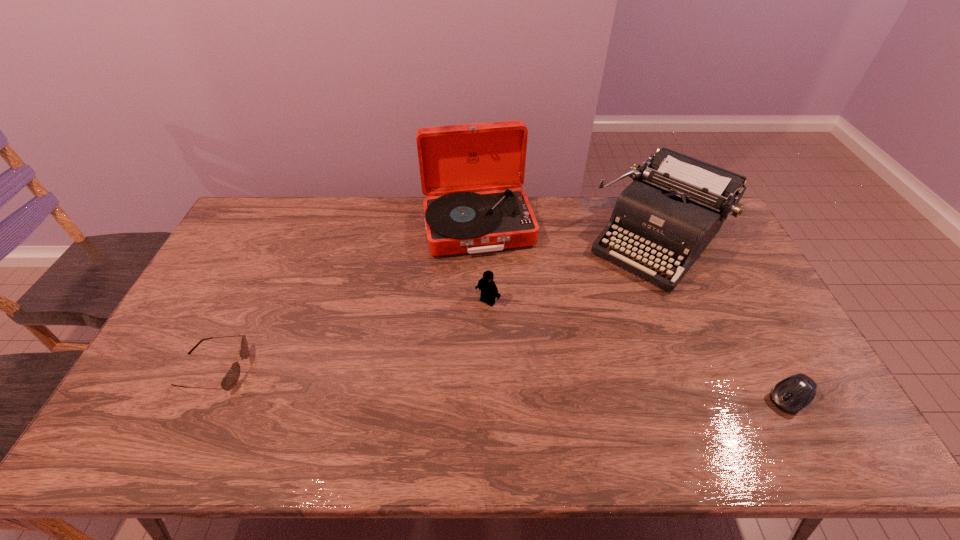
You are a GUI agent. You are given a task and a screenshot of the screen. Output one action in this format:
    pyautogui.click(x=<x>, y=<y>)
    Task: Click on the object that is at the left edge
    
    Given the screenshot: What is the action you would take?
    pyautogui.click(x=231, y=378)

This screenshot has width=960, height=540. Find the location of `mouse that is at the right edge`. mouse that is at the right edge is located at coordinates (790, 395).

Find the location of a particular element. typewriter at the right edge is located at coordinates (676, 204).

Where is `object positioned at the near left corner`? object positioned at the near left corner is located at coordinates (231, 378).

The width and height of the screenshot is (960, 540). In order to click on object that is at the far right corner in this screenshot , I will do [676, 204].

This screenshot has width=960, height=540. Identify the location of object that is at the near right corner. (790, 395).

Locate an element on the screen. This screenshot has height=540, width=960. free space at the far edge of the desktop is located at coordinates (570, 217).

You are a GUI agent. You are given a task and a screenshot of the screen. Output one action in this format:
    pyautogui.click(x=<x>, y=<y>)
    Task: Click on the free region at the near edge
    
    Given the screenshot: What is the action you would take?
    pyautogui.click(x=509, y=405)

Where is `free space at the left edge of the desktop`? free space at the left edge of the desktop is located at coordinates (158, 379).

Find the location of a particular element. This screenshot has width=960, height=540. free location at the right edge is located at coordinates (751, 288).